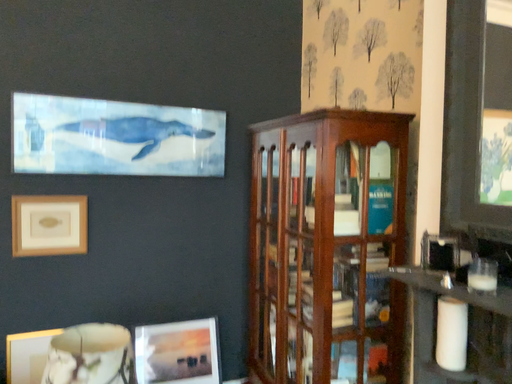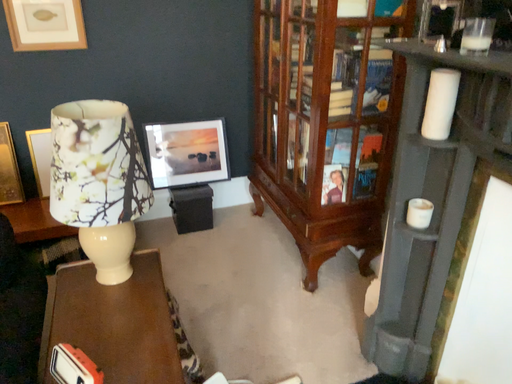
Question: How did the camera likely rotate when shooting the video?

Choices:
 (A) rotated upward
 (B) rotated downward

Answer: (B)